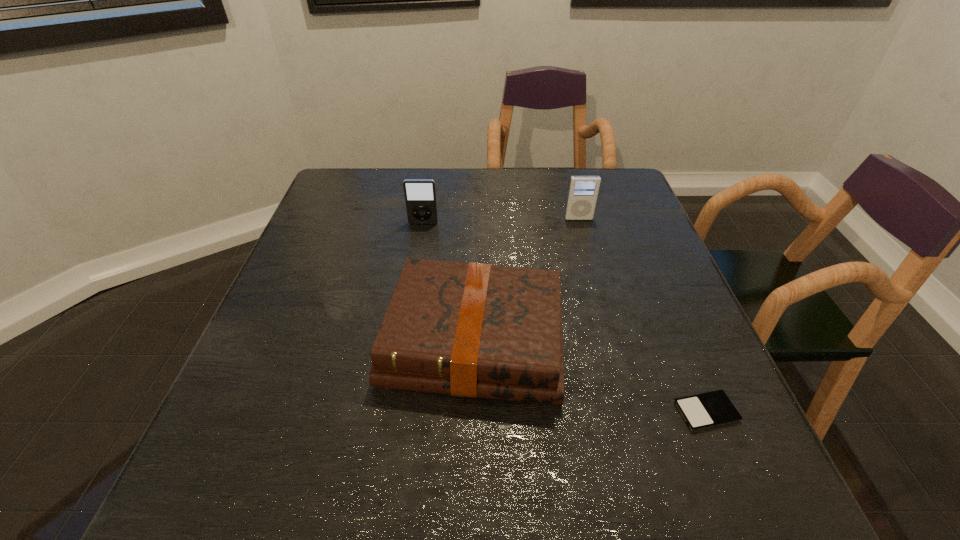
Where is `free space located on the back of the shortest iPod`? The width and height of the screenshot is (960, 540). free space located on the back of the shortest iPod is located at coordinates (674, 334).

Image resolution: width=960 pixels, height=540 pixels. Find the location of `free region at the far edge of the desktop`. free region at the far edge of the desktop is located at coordinates (381, 210).

You are a GUI agent. You are given a task and a screenshot of the screen. Output one action in this format:
    pyautogui.click(x=<x>, y=<y>)
    Task: Click on the vacant space at the near edge
    The width and height of the screenshot is (960, 540).
    Given the screenshot: What is the action you would take?
    pyautogui.click(x=415, y=464)

Identify the location of vacant position at the left edge of the desktop. This screenshot has width=960, height=540. (349, 230).

This screenshot has height=540, width=960. In the image, there is a desktop. Find the location of `vacant region at the right edge`. vacant region at the right edge is located at coordinates (614, 246).

The width and height of the screenshot is (960, 540). What are the coordinates of `vacant region at the near left corner of the desktop` in the screenshot? It's located at (285, 475).

Identify the location of free space that is in between the rightmost iPod and the second iPod from left to right. (642, 315).

Identify the location of free area in between the second object from right to left and the second farthest iPod. (501, 221).

Image resolution: width=960 pixels, height=540 pixels. I want to click on vacant point located between the rightmost iPod and the second shortest object, so click(x=590, y=376).

Where is `vacant area between the second farthest iPod and the shortest object`? The width and height of the screenshot is (960, 540). vacant area between the second farthest iPod and the shortest object is located at coordinates tap(564, 318).